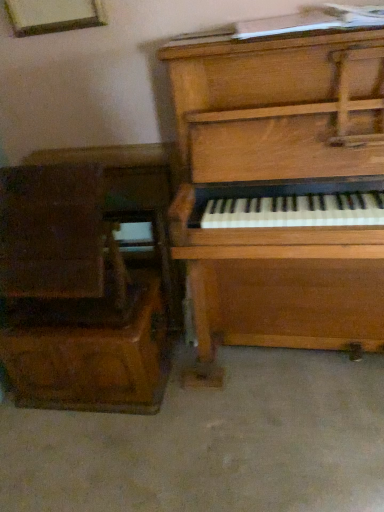
This screenshot has height=512, width=384. What do you see at coordinates (93, 357) in the screenshot?
I see `wooden drawer at left` at bounding box center [93, 357].

Where is `wooden drawer at left`? Image resolution: width=384 pixels, height=512 pixels. wooden drawer at left is located at coordinates (93, 357).

This screenshot has height=512, width=384. Find the location of `smooth concrete floor at lower center`. smooth concrete floor at lower center is located at coordinates (212, 443).

Where is `wooden piano at right`? The image size is (384, 512). wooden piano at right is located at coordinates (278, 189).

Would you say wooden piano at right is a long distance from wooden drawer at left?

No, there isn't a large distance between wooden piano at right and wooden drawer at left.

Is wooden piano at right closer to camera compared to wooden drawer at left?

Yes, wooden piano at right is closer to the viewer.

Based on the photo, from the image's perspective, is wooden piano at right located above or below wooden drawer at left?

Based on their image positions, wooden piano at right is located above wooden drawer at left.

Is wooden piano at right surrounding wooden drawer at left?

No, wooden piano at right does not contain wooden drawer at left.

At what (x,y) coordinates should I click in order to perform the action: click on piano in front of the smooth concrete floor at lower center. Please return your answer as a coordinate pair (x, y). This screenshot has height=512, width=384. Looking at the image, I should click on (278, 189).

From their relative heights in the image, would you say wooden piano at right is taller or shorter than smooth concrete floor at lower center?

Clearly, wooden piano at right is taller compared to smooth concrete floor at lower center.

Can you tell me how much wooden piano at right and smooth concrete floor at lower center differ in facing direction?

There is a 89.5-degree angle between the facing directions of wooden piano at right and smooth concrete floor at lower center.

Is smooth concrete floor at lower center positioned far away from wooden piano at right?

Actually, smooth concrete floor at lower center and wooden piano at right are a little close together.

From a real-world perspective, between smooth concrete floor at lower center and wooden piano at right, who is vertically lower?

From a 3D spatial view, smooth concrete floor at lower center is below.

Who is bigger, smooth concrete floor at lower center or wooden piano at right?

Bigger between the two is wooden piano at right.

Which of these two, smooth concrete floor at lower center or wooden piano at right, is wider?

smooth concrete floor at lower center is wider.

Considering the points (44, 379) and (365, 62), which point is in front, point (44, 379) or point (365, 62)?

Point (365, 62)

Does wooden drawer at left appear on the left side of wooden piano at right?

Indeed, wooden drawer at left is positioned on the left side of wooden piano at right.

From the image's perspective, between wooden drawer at left and wooden piano at right, which one is located above?

From the image's view, wooden piano at right is above.

Who is taller, wooden drawer at left or wooden piano at right?

With more height is wooden piano at right.

The width and height of the screenshot is (384, 512). What are the coordinates of `drawer on the left of smooth concrete floor at lower center` in the screenshot? It's located at (93, 357).

Considering the positions of objects smooth concrete floor at lower center and wooden drawer at left in the image provided, who is in front, smooth concrete floor at lower center or wooden drawer at left?

smooth concrete floor at lower center.

From a real-world perspective, is smooth concrete floor at lower center over wooden drawer at left?

Incorrect, from a real-world perspective, smooth concrete floor at lower center is lower than wooden drawer at left.

Is smooth concrete floor at lower center turned away from wooden drawer at left?

No, smooth concrete floor at lower center's orientation is not away from wooden drawer at left.

Considering the points (88, 407) and (33, 452), which point is in front, point (88, 407) or point (33, 452)?

The point (33, 452) is closer to the camera.

Which is in front, wooden drawer at left or smooth concrete floor at lower center?

smooth concrete floor at lower center is in front.

From a real-world perspective, does wooden drawer at left sit lower than smooth concrete floor at lower center?

No.

The height and width of the screenshot is (512, 384). I want to click on piano above the wooden drawer at left (from the image's perspective), so click(278, 189).

Where is `piano on the right of the smooth concrete floor at lower center`? piano on the right of the smooth concrete floor at lower center is located at coordinates (278, 189).

Estimate the real-world distances between objects in this image. Which object is closer to wooden piano at right, smooth concrete floor at lower center or wooden drawer at left?

Among the two, wooden drawer at left is located nearer to wooden piano at right.

Looking at this image, from the image, which object appears to be nearer to wooden drawer at left, smooth concrete floor at lower center or wooden piano at right?

Based on the image, smooth concrete floor at lower center appears to be nearer to wooden drawer at left.

Which object lies further to the anchor point wooden piano at right, wooden drawer at left or smooth concrete floor at lower center?

smooth concrete floor at lower center is further to wooden piano at right.

When comparing their distances from wooden drawer at left, does wooden piano at right or smooth concrete floor at lower center seem further?

wooden piano at right lies further to wooden drawer at left than the other object.

Based on their spatial positions, is wooden drawer at left or wooden piano at right closer to smooth concrete floor at lower center?

wooden drawer at left.

Considering their positions, is wooden piano at right positioned closer to smooth concrete floor at lower center than wooden drawer at left?

wooden drawer at left lies closer to smooth concrete floor at lower center than the other object.

Find the location of a particular element. concrete situated between wooden drawer at left and wooden piano at right from left to right is located at coordinates (212, 443).